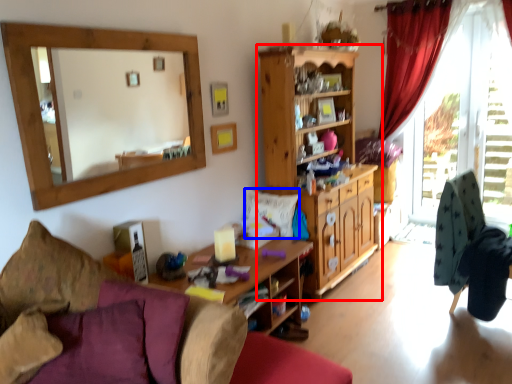
Question: Which object is closer to the camera taking this photo, cabinetry (highlighted by a red box) or pillow (highlighted by a blue box)?

Choices:
 (A) cabinetry
 (B) pillow

Answer: (A)